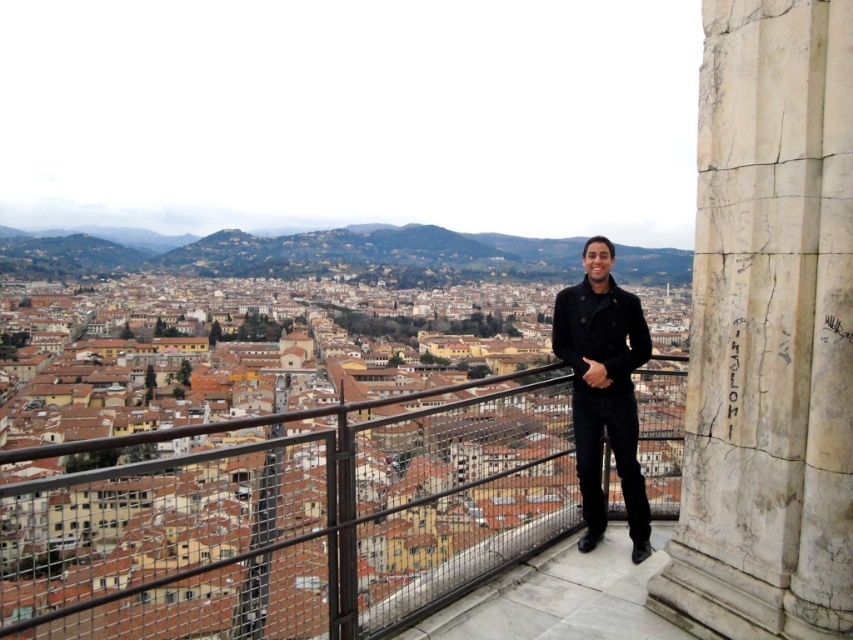
Which is below, metal mesh railing at center or black wool coat at center?

Positioned lower is metal mesh railing at center.

Is metal mesh railing at center below black wool coat at center?

Indeed, metal mesh railing at center is positioned under black wool coat at center.

Which is behind, point (85, 611) or point (589, 522)?

Point (589, 522)

Where is `metal mesh railing at center`? metal mesh railing at center is located at coordinates (291, 525).

Who is higher up, white marble pillar at right or black wool coat at center?

white marble pillar at right is higher up.

Between point (776, 307) and point (598, 509), which one is positioned behind?

Point (598, 509)

This screenshot has height=640, width=853. In order to click on white marble pillar at right in this screenshot , I will do `click(769, 332)`.

The image size is (853, 640). Find the location of `white marble pillar at right`. white marble pillar at right is located at coordinates (x=769, y=332).

Is metal mesh railing at center in front of white marble pillar at right?

No.

Who is taller, metal mesh railing at center or white marble pillar at right?

white marble pillar at right

In order to click on metal mesh railing at center in this screenshot , I will do `click(291, 525)`.

I want to click on metal mesh railing at center, so click(291, 525).